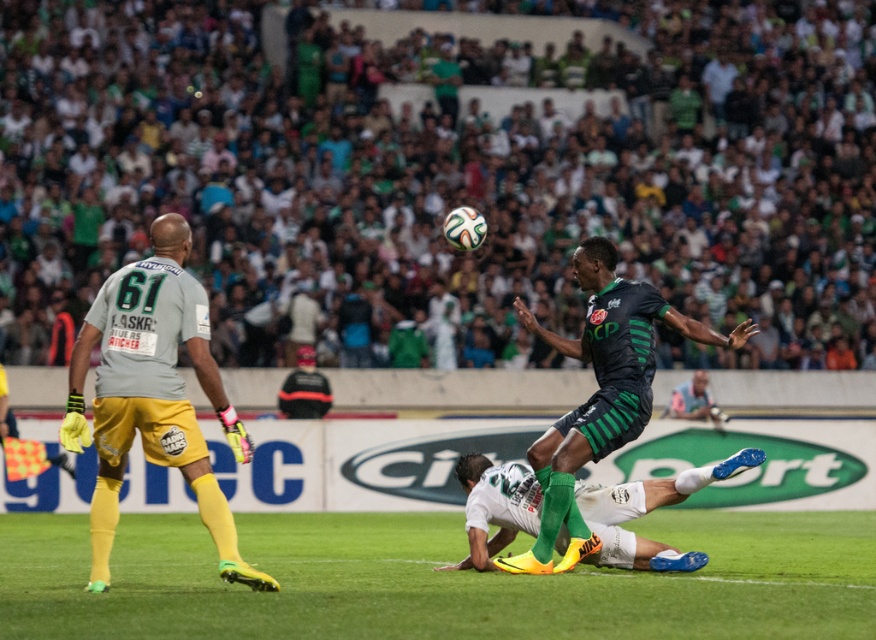
You are a soccer coach analyzing the match. Based on the scene, which object is taller between the green grass at center and the black matte soccer player at center?

The black matte soccer player at center is taller than the green grass at center.

What is the 2D coordinate of the green grass at center?

The green grass at center is located at the 2D coordinate point of (435, 580).

You are a soccer coach analyzing the match. You notice the green grass at center and the white matte soccer ball at center. Which object takes up more space in the image?

The green grass at center is larger in size than the white matte soccer ball at center, so it takes up more space in the image.